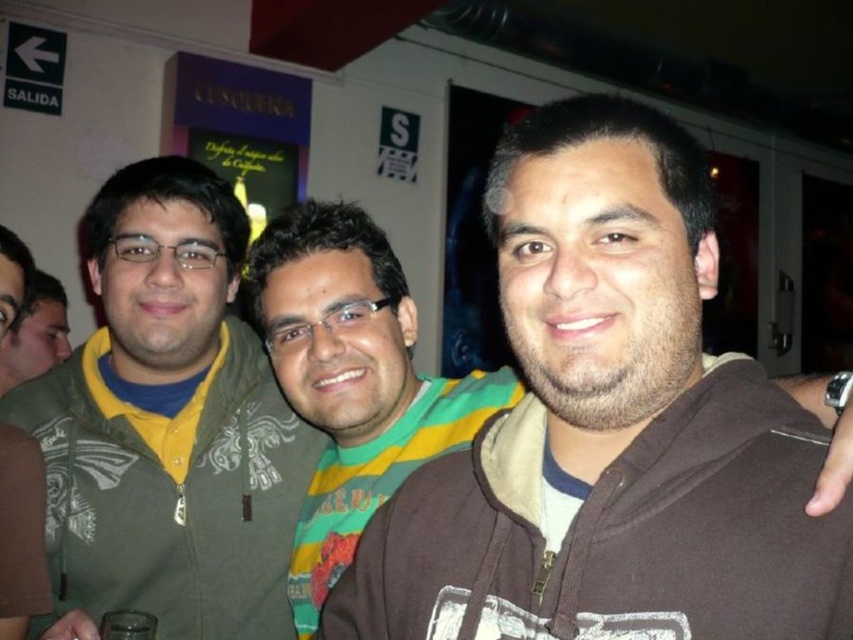
Question: Which point appears closest to the camera in this image?

Choices:
 (A) (463, 397)
 (B) (297, 460)

Answer: (A)

Question: Can you confirm if green textured hoodie at left is positioned above brown fleece jacket at center?

Choices:
 (A) no
 (B) yes

Answer: (B)

Question: Can you confirm if green textured hoodie at left is positioned to the left of brown fleece jacket at center?

Choices:
 (A) yes
 (B) no

Answer: (A)

Question: Which object is closer to the camera taking this photo?

Choices:
 (A) brown fleece jacket at center
 (B) green textured hoodie at left

Answer: (B)

Question: Can you confirm if green textured hoodie at left is positioned to the right of brown fleece jacket at center?

Choices:
 (A) no
 (B) yes

Answer: (A)

Question: Which of the following is the farthest from the observer?

Choices:
 (A) (831, 385)
 (B) (212, 212)

Answer: (B)